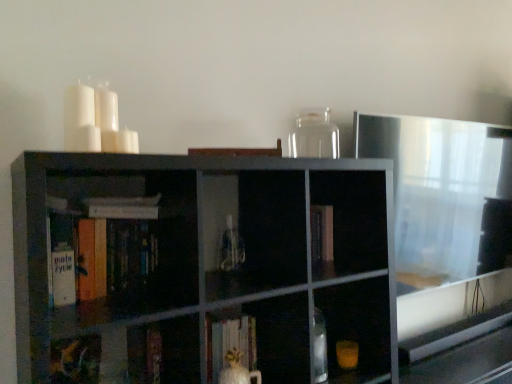
Question: Does hardcover book at center, which appears as the 1th book when viewed from the top, have a larger size compared to matte green book at lower left, the 1th book positioned from the bottom?

Choices:
 (A) yes
 (B) no

Answer: (B)

Question: Could you tell me if hardcover book at center, which appears as the 1th book when viewed from the top, is turned towards matte green book at lower left, the fifth book from the top?

Choices:
 (A) no
 (B) yes

Answer: (A)

Question: Is hardcover book at center, which is counted as the 5th book, starting from the bottom, not within matte green book at lower left, the fifth book from the top?

Choices:
 (A) yes
 (B) no

Answer: (A)

Question: Considering the relative sizes of hardcover book at center, which is counted as the 5th book, starting from the bottom, and matte green book at lower left, the 1th book positioned from the bottom, in the image provided, is hardcover book at center, which is counted as the 5th book, starting from the bottom, taller than matte green book at lower left, the 1th book positioned from the bottom,?

Choices:
 (A) yes
 (B) no

Answer: (B)

Question: Is hardcover book at center, which appears as the 1th book when viewed from the top, shorter than matte green book at lower left, the 1th book positioned from the bottom?

Choices:
 (A) yes
 (B) no

Answer: (A)

Question: In the image, is white matte book at upper left, arranged as the 4th book when ordered from the bottom, on the left side or the right side of matte green book at lower left, the fifth book from the top?

Choices:
 (A) left
 (B) right

Answer: (B)

Question: Considering the positions of point (91, 198) and point (68, 352), is point (91, 198) closer or farther from the camera than point (68, 352)?

Choices:
 (A) farther
 (B) closer

Answer: (A)

Question: From the image's perspective, is white matte book at upper left, arranged as the 4th book when ordered from the bottom, above or below matte green book at lower left, the fifth book from the top?

Choices:
 (A) below
 (B) above

Answer: (B)

Question: Considering their positions, is white matte book at upper left, arranged as the 4th book when ordered from the bottom, located in front of or behind matte green book at lower left, the fifth book from the top?

Choices:
 (A) behind
 (B) front

Answer: (B)

Question: From the image's perspective, relative to white matte book at left, the third book in the bottom-to-top sequence, is matte black bookshelf at center above or below?

Choices:
 (A) below
 (B) above

Answer: (A)

Question: In terms of height, does matte black bookshelf at center look taller or shorter compared to white matte book at left, placed as the 3th book when sorted from top to bottom?

Choices:
 (A) tall
 (B) short

Answer: (A)

Question: Would you say matte black bookshelf at center is to the left or to the right of white matte book at left, placed as the 3th book when sorted from top to bottom, in the picture?

Choices:
 (A) left
 (B) right

Answer: (B)

Question: Does point (x=245, y=261) appear closer or farther from the camera than point (x=91, y=253)?

Choices:
 (A) closer
 (B) farther

Answer: (B)

Question: Is white matte book at left, placed as the 3th book when sorted from top to bottom, spatially inside hardcover book at center, which is counted as the 5th book, starting from the bottom, or outside of it?

Choices:
 (A) outside
 (B) inside

Answer: (A)

Question: From a real-world perspective, is white matte book at left, the third book in the bottom-to-top sequence, physically located above or below hardcover book at center, which is counted as the 5th book, starting from the bottom?

Choices:
 (A) below
 (B) above

Answer: (A)